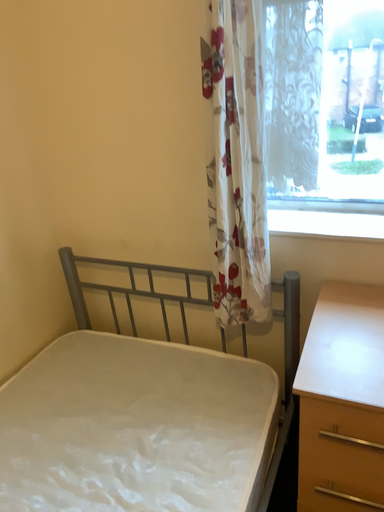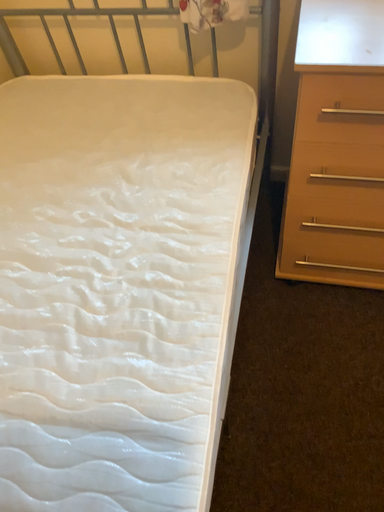
Question: Which way did the camera rotate in the video?

Choices:
 (A) rotated left
 (B) rotated right

Answer: (B)